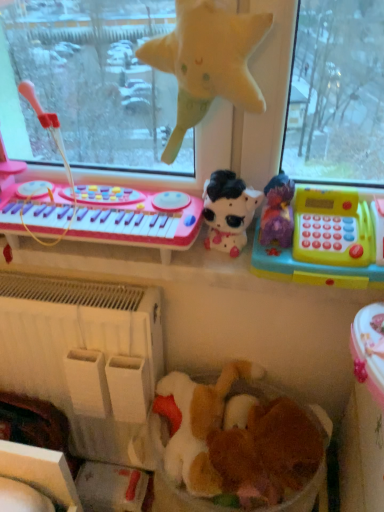
Question: In terms of width, does fluffy white stuffed animal at center, which is the fourth toy from top to bottom, look wider or thinner when compared to fuzzy brown teddy bear at center, which appears as the fifth toy when viewed from the top?

Choices:
 (A) wide
 (B) thin

Answer: (A)

Question: From a real-world perspective, is fluffy white stuffed animal at center, which is the fourth toy from top to bottom, physically located above or below fuzzy brown teddy bear at center, positioned as the 1th toy in bottom-to-top order?

Choices:
 (A) above
 (B) below

Answer: (B)

Question: Considering the real-world distances, which object is farthest from the fuzzy brown teddy bear at center, positioned as the 1th toy in bottom-to-top order?

Choices:
 (A) white plastic radiator at lower left
 (B) yellow plush star at upper center, positioned as the 1th toy in top-to-bottom order
 (C) plush black and white cow at center, arranged as the 2th toy when viewed from the top
 (D) yellow plastic cash register at right, the third toy in the top-to-bottom sequence
 (E) fluffy white stuffed animal at center, the second toy from the bottom

Answer: (B)

Question: Which object is the farthest from the white plastic radiator at lower left?

Choices:
 (A) yellow plush star at upper center, positioned as the 1th toy in top-to-bottom order
 (B) fuzzy brown teddy bear at center, which appears as the fifth toy when viewed from the top
 (C) yellow plastic cash register at right, the third toy in the top-to-bottom sequence
 (D) plush black and white cow at center, positioned as the fourth toy in bottom-to-top order
 (E) fluffy white stuffed animal at center, the second toy from the bottom

Answer: (A)